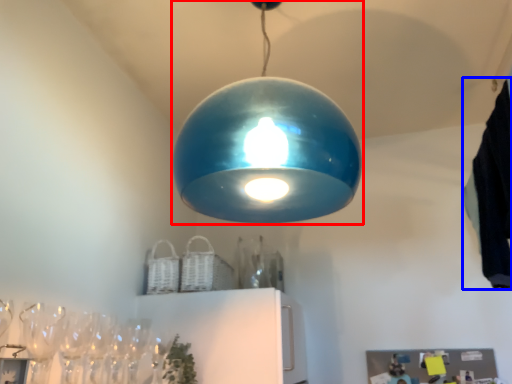
Question: Which of the following is the closest to the observer, lamp (highlighted by a red box) or laundry (highlighted by a blue box)?

Choices:
 (A) lamp
 (B) laundry

Answer: (A)